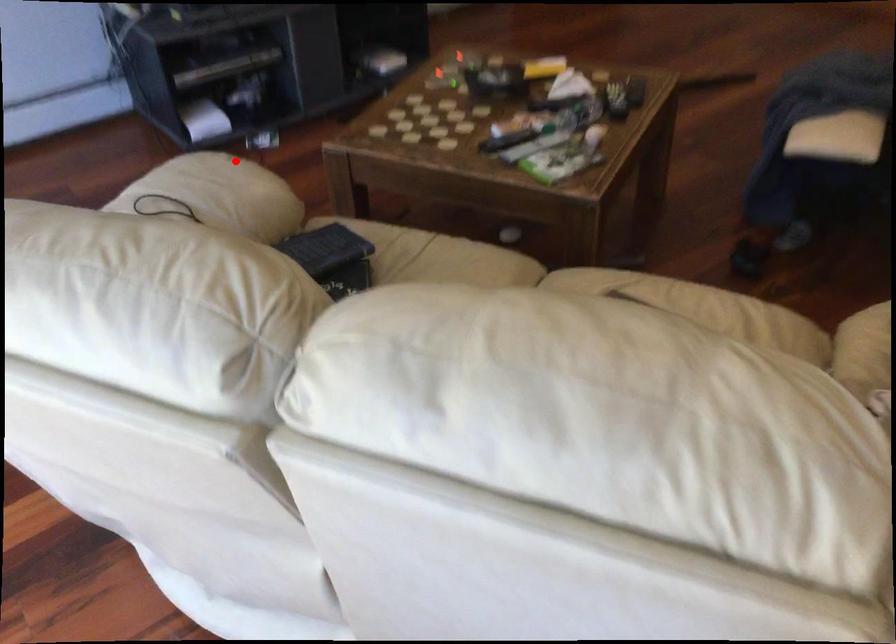
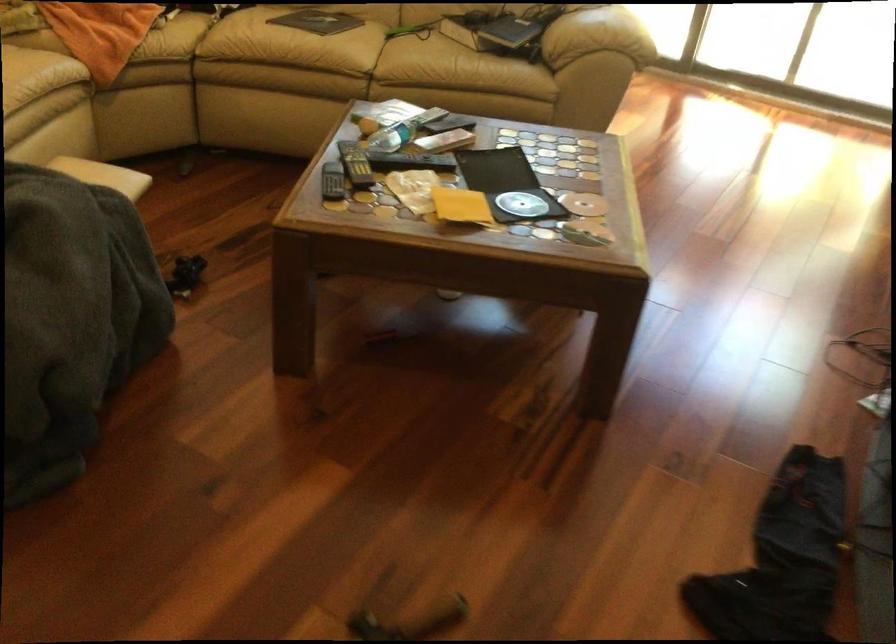
Question: I am providing you with two images of the same scene from different viewpoints. A red point is shown in image1. For the corresponding object point in image2, is it positioned nearer or farther from the camera?

Choices:
 (A) Nearer
 (B) Farther

Answer: (B)